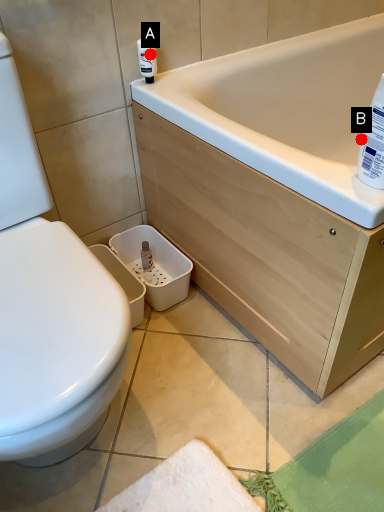
Question: Two points are circled on the image, labeled by A and B beside each circle. Which point is farther from the camera taking this photo?

Choices:
 (A) A is further
 (B) B is further

Answer: (B)